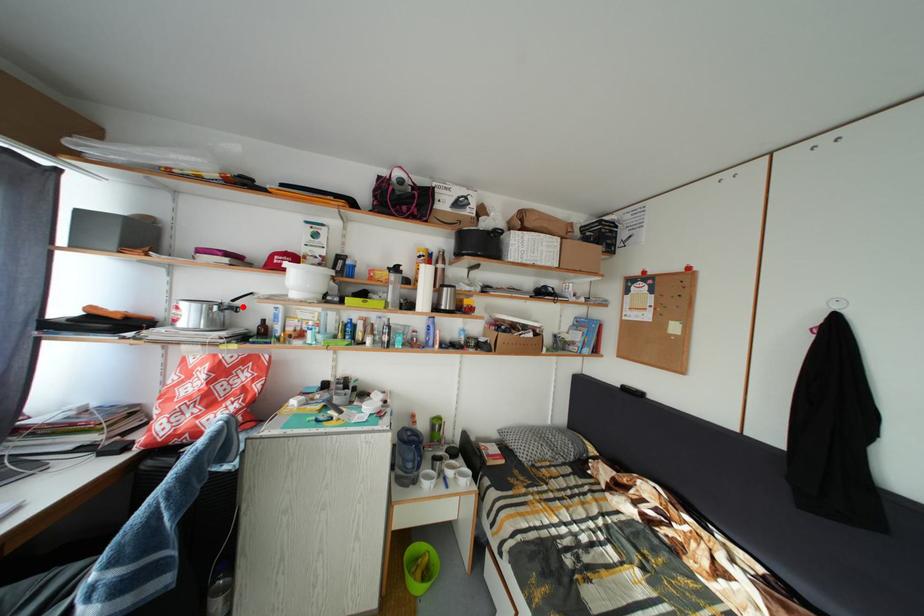
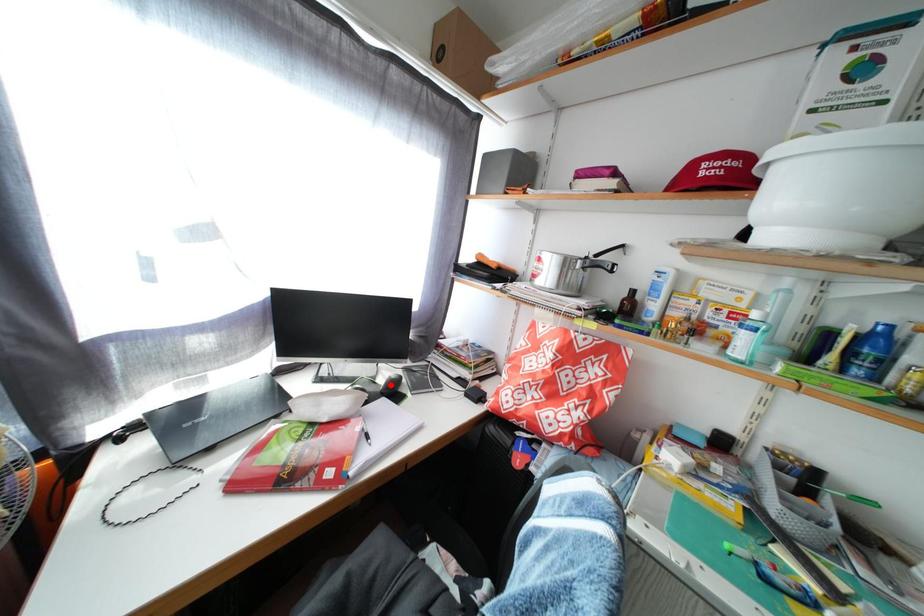
I am providing you with two images of the same scene from different viewpoints. A red point is marked on the first image and another point is marked on the second image. Is the red point in image1 aligned with the point shown in image2?

No